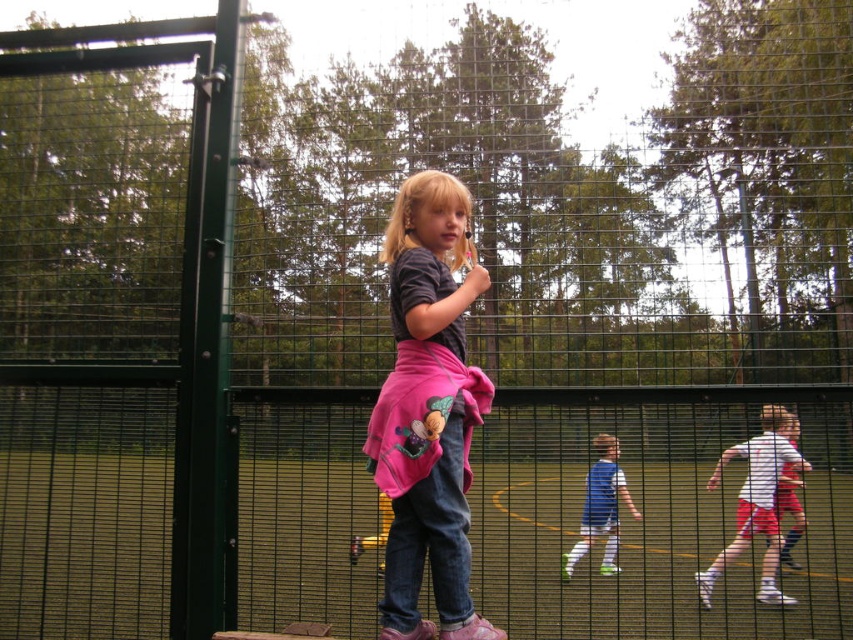
Question: Is pink fabric skirt at center bigger than white matte shirt at center?

Choices:
 (A) no
 (B) yes

Answer: (A)

Question: Which point is farther from the camera taking this photo?

Choices:
 (A) (573, 552)
 (B) (422, 369)

Answer: (A)

Question: Which of the following is the closest to the observer?

Choices:
 (A) white matte shirt at center
 (B) white cotton shirt at right
 (C) blue jersey at center
 (D) pink fabric skirt at center

Answer: (D)

Question: Is white matte shirt at center closer to camera compared to white cotton shirt at right?

Choices:
 (A) no
 (B) yes

Answer: (B)

Question: Among these objects, which one is farthest from the camera?

Choices:
 (A) white cotton shirt at right
 (B) blue jersey at center
 (C) white matte shirt at center
 (D) pink fabric skirt at center

Answer: (A)

Question: Does white matte shirt at center appear under blue jersey at center?

Choices:
 (A) no
 (B) yes

Answer: (A)